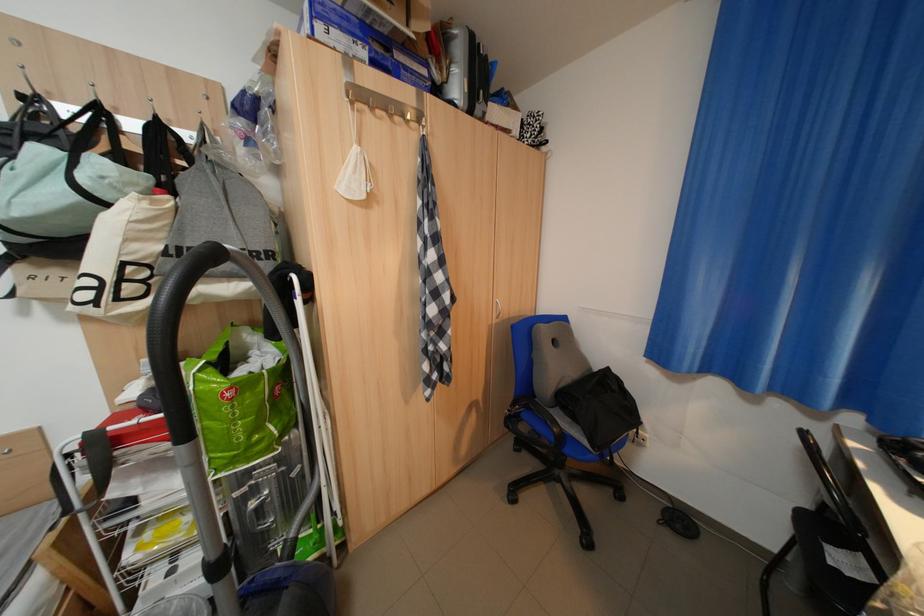
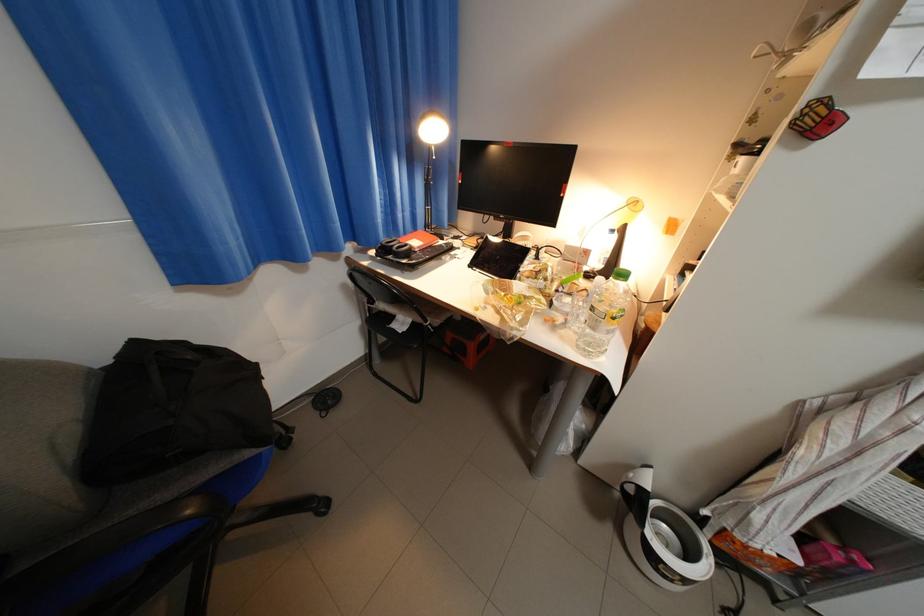
Find the pixel in the second image that matches (x=619, y=370) in the first image.

(147, 344)